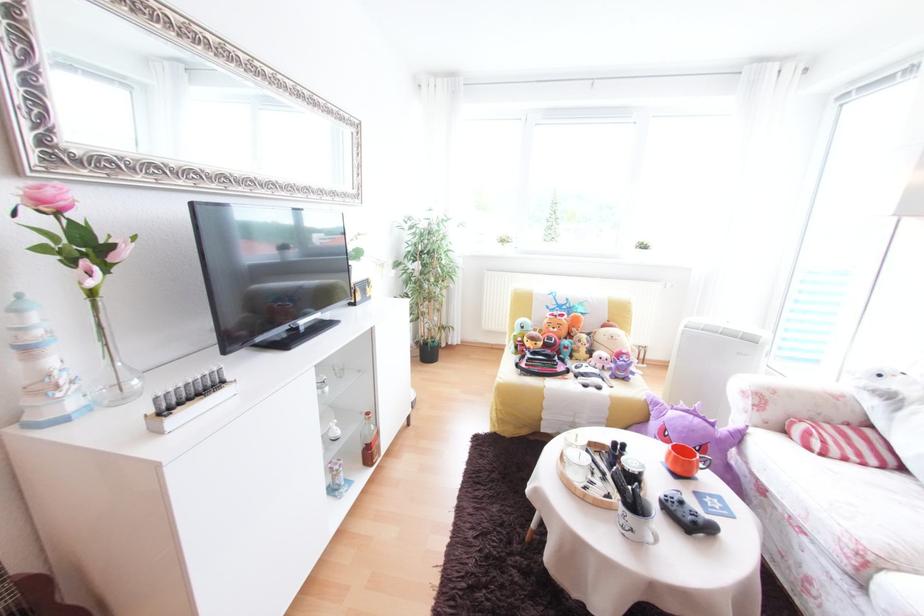
You are a GUI agent. You are given a task and a screenshot of the screen. Output one action in this format:
    pyautogui.click(x=<x>, y=<y>)
    Task: Click on the purple plush toy
    Image resolution: width=924 pixels, height=616 pixels.
    Given the screenshot: What is the action you would take?
    pyautogui.click(x=694, y=432)